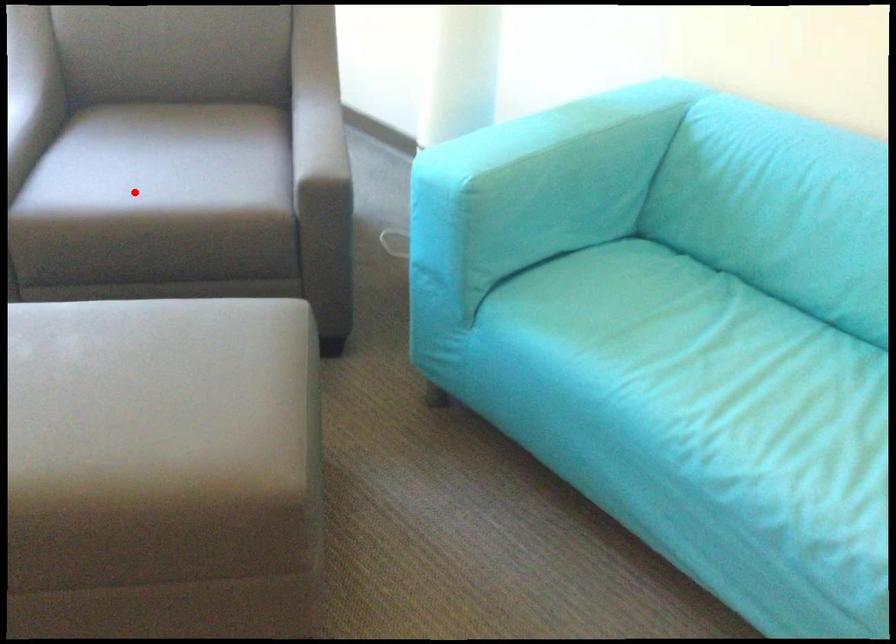
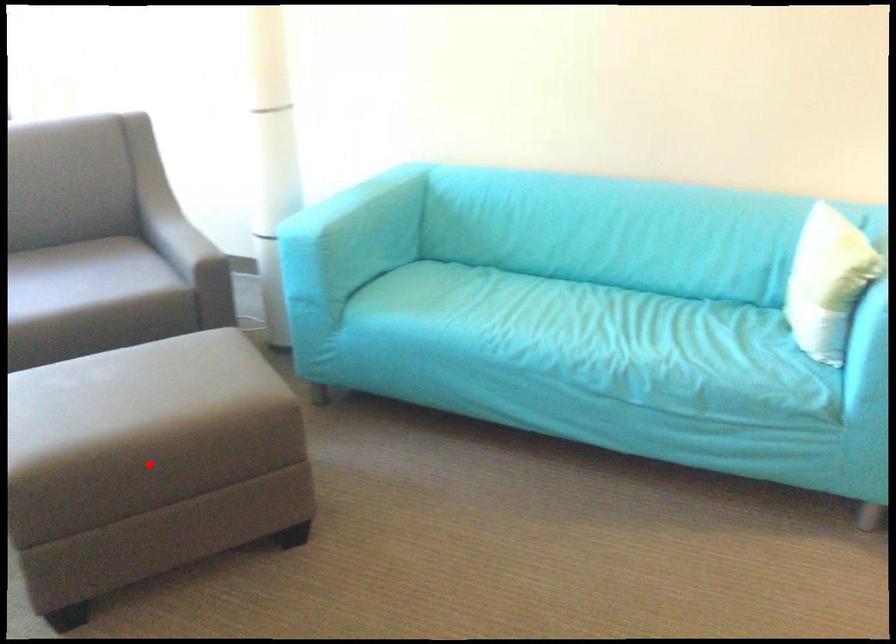
I am providing you with two images of the same scene from different viewpoints. A red point is marked on the first image and another point is marked on the second image. Are the points marked in image1 and image2 representing the same 3D position?

No